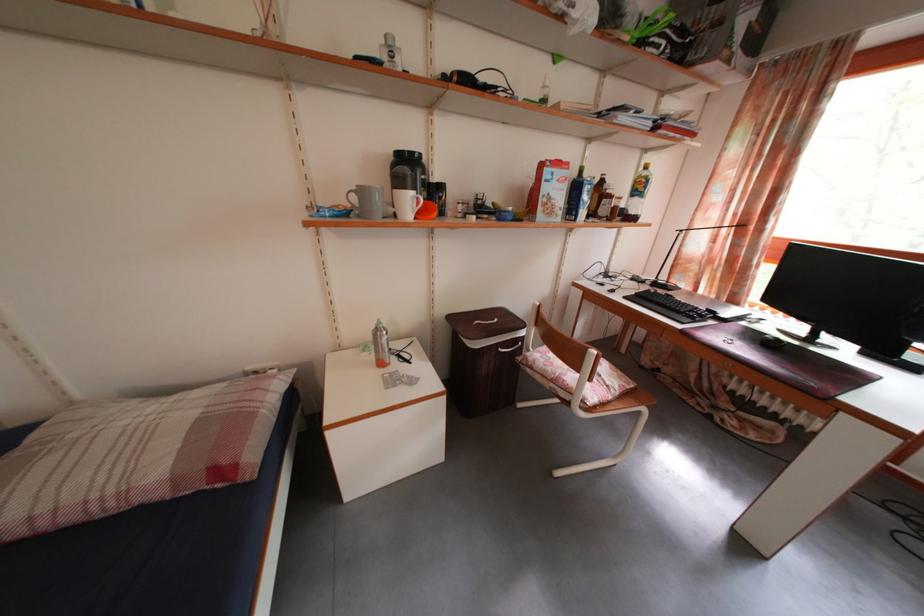
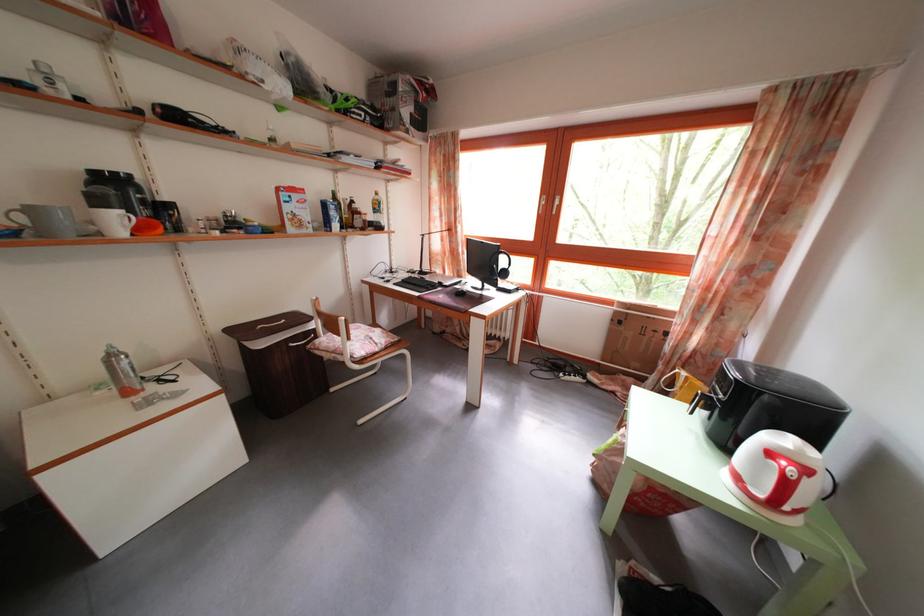
In the second image, find the point that corresponds to (361,206) in the first image.

(30, 225)